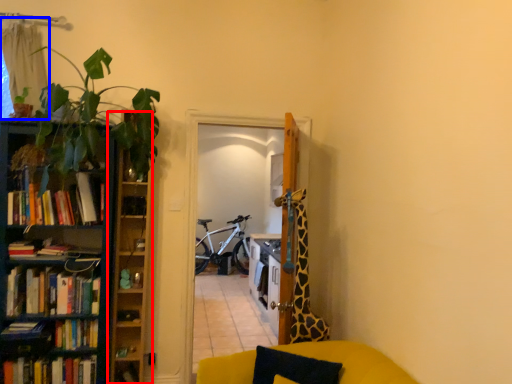
Question: Which object is closer to the camera taking this photo, cabinet (highlighted by a red box) or curtain (highlighted by a blue box)?

Choices:
 (A) cabinet
 (B) curtain

Answer: (B)